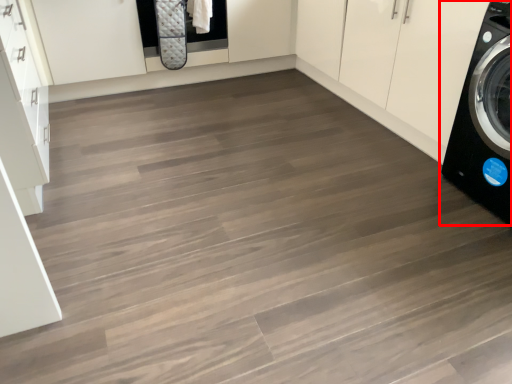
Question: Considering the relative positions of washing machine (annotated by the red box) and cabinetry in the image provided, where is washing machine (annotated by the red box) located with respect to the staircase?

Choices:
 (A) left
 (B) right

Answer: (B)